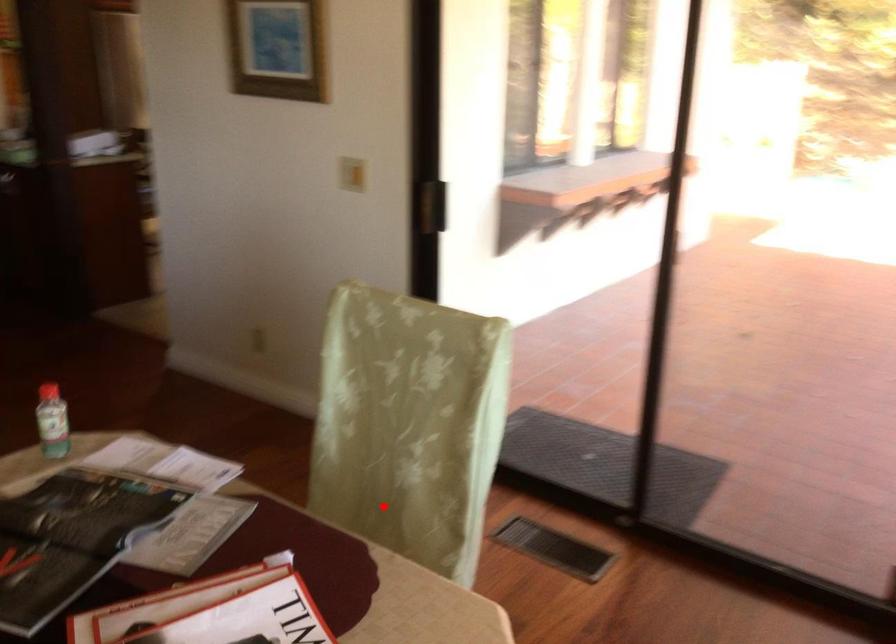
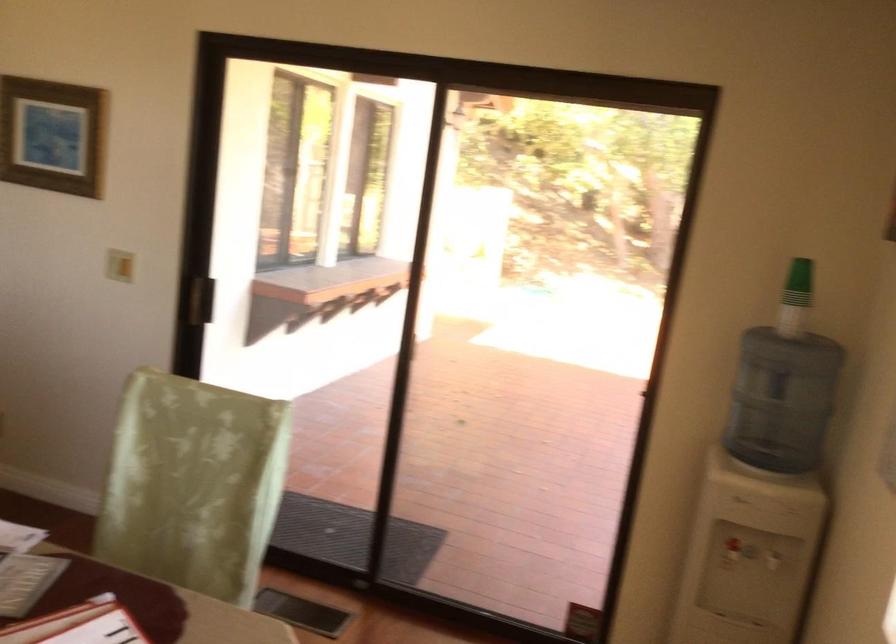
Question: I am providing you with two images of the same scene from different viewpoints. In image1, a red point is highlighted. Considering the same 3D point in image2, which of the following is correct?

Choices:
 (A) It is closer
 (B) It is farther

Answer: (B)